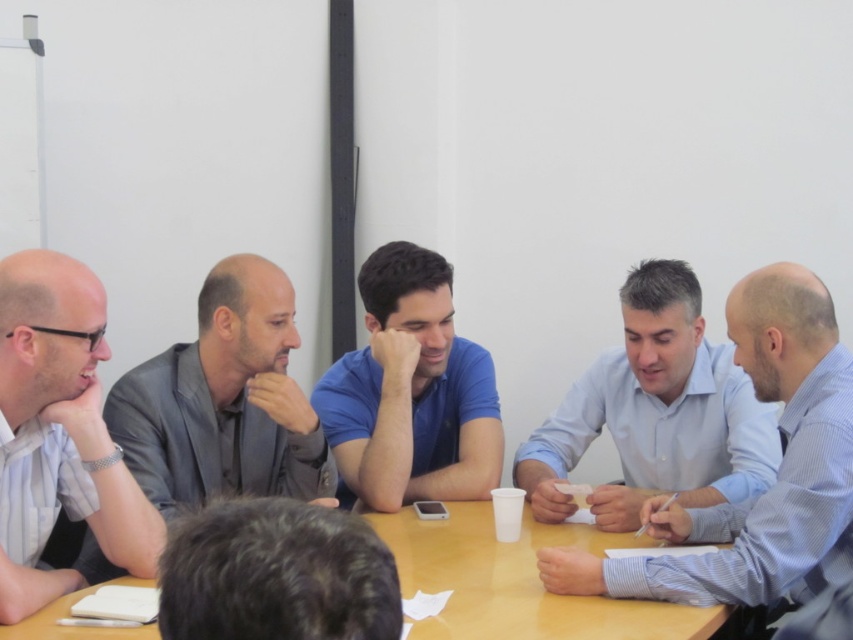
You are a photographer trying to capture a group photo of the five individuals seated around the table. You want to ensure that both the blue shirt at center and the dark brown hair at center are clearly visible in the photo. Given their sizes, which object should you focus on to ensure proper focus and clarity?

The blue shirt at center is bigger than dark brown hair at center, so focusing on the blue shirt at center will ensure proper focus and clarity since it is larger and more prominent in the frame.

You are a photographer taking a picture of the meeting. You notice two points of interest marked as point 1 at coordinates point (294, 438) and point 2 at coordinates point (90, 342). Which point is closer to the camera?

Point (90, 342) is closer to the camera than point (294, 438) because the description states that point (294, 438) is further away.

Looking at this image, you are a photographer in a meeting room. You see the blue shirt at center and the dark brown hair at center. Which one is closer to the camera?

The blue shirt at center is positioned under dark brown hair at center, so the dark brown hair at center is closer to the camera.